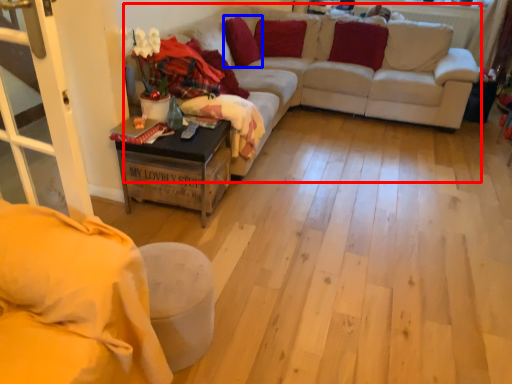
Question: Among these objects, which one is nearest to the camera, couch (highlighted by a red box) or pillow (highlighted by a blue box)?

Choices:
 (A) couch
 (B) pillow

Answer: (A)